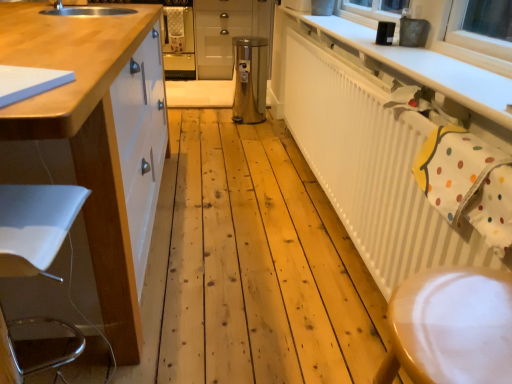
Question: From a real-world perspective, is stainless steel trash can at center over white glossy cabinet at left, which appears as the first cabinetry when ordered from the bottom?

Choices:
 (A) no
 (B) yes

Answer: (A)

Question: Is stainless steel trash can at center shorter than white glossy cabinet at left, the second cabinetry positioned from the back?

Choices:
 (A) no
 (B) yes

Answer: (B)

Question: Can you confirm if stainless steel trash can at center is positioned to the left of white glossy cabinet at left, which appears as the first cabinetry when ordered from the bottom?

Choices:
 (A) yes
 (B) no

Answer: (B)

Question: Is stainless steel trash can at center closer to camera compared to white glossy cabinet at left, which appears as the first cabinetry when ordered from the bottom?

Choices:
 (A) no
 (B) yes

Answer: (A)

Question: From the image's perspective, is stainless steel trash can at center above white glossy cabinet at left, which is counted as the second cabinetry, starting from the top?

Choices:
 (A) no
 (B) yes

Answer: (B)

Question: From a real-world perspective, relative to white textured radiator at upper right, is wooden step stool at lower right vertically above or below?

Choices:
 (A) above
 (B) below

Answer: (A)

Question: In terms of size, does wooden step stool at lower right appear bigger or smaller than white textured radiator at upper right?

Choices:
 (A) big
 (B) small

Answer: (B)

Question: Considering their positions, is wooden step stool at lower right located in front of or behind white textured radiator at upper right?

Choices:
 (A) behind
 (B) front

Answer: (B)

Question: Is wooden step stool at lower right taller or shorter than white textured radiator at upper right?

Choices:
 (A) tall
 (B) short

Answer: (B)

Question: In the image, is wooden step stool at lower right on the left side or the right side of metallic silver cabinet at center, placed as the 1th cabinetry when sorted from back to front?

Choices:
 (A) left
 (B) right

Answer: (B)

Question: Considering the positions of wooden step stool at lower right and metallic silver cabinet at center, the 2th cabinetry in the front-to-back sequence, in the image, is wooden step stool at lower right taller or shorter than metallic silver cabinet at center, the 2th cabinetry in the front-to-back sequence,?

Choices:
 (A) short
 (B) tall

Answer: (A)

Question: Which is correct: wooden step stool at lower right is inside metallic silver cabinet at center, which appears as the 1th cabinetry when viewed from the top, or outside of it?

Choices:
 (A) inside
 (B) outside

Answer: (B)

Question: From the image's perspective, is wooden step stool at lower right positioned above or below metallic silver cabinet at center, the 2th cabinetry from the bottom?

Choices:
 (A) above
 (B) below

Answer: (B)

Question: Is white glossy cabinet at left, the second cabinetry positioned from the back, inside or outside of white textured radiator at upper right?

Choices:
 (A) inside
 (B) outside

Answer: (B)

Question: Considering their positions, is white glossy cabinet at left, the second cabinetry positioned from the back, located in front of or behind white textured radiator at upper right?

Choices:
 (A) behind
 (B) front

Answer: (B)